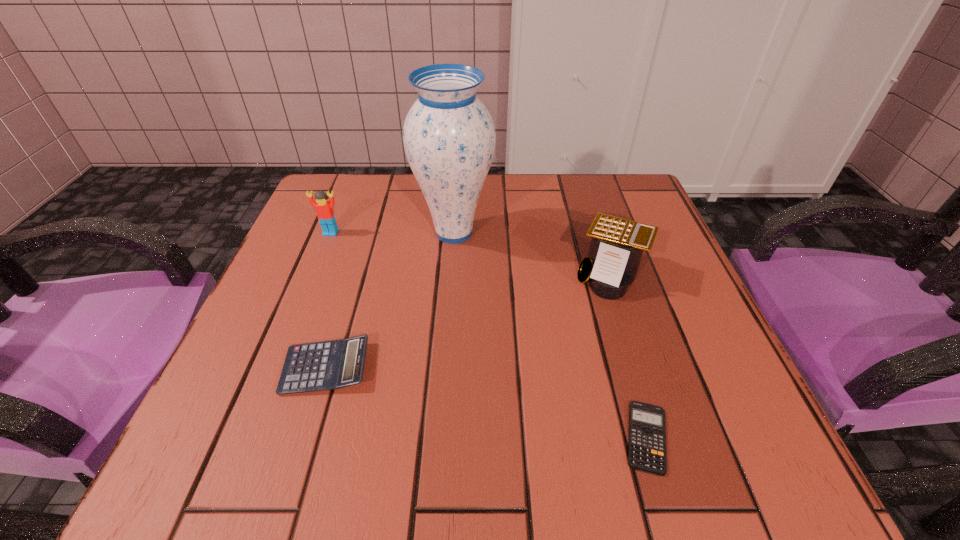
The height and width of the screenshot is (540, 960). What are the coordinates of `free point located on the face of the Lego` in the screenshot? It's located at (265, 395).

At what (x,y) coordinates should I click in order to perform the action: click on free space located 0.400m on the back of the fourth farthest object. Please return your answer as a coordinate pair (x, y). Looking at the image, I should click on (374, 210).

Image resolution: width=960 pixels, height=540 pixels. Find the location of `vacant space located 0.120m on the left of the nearest calculator`. vacant space located 0.120m on the left of the nearest calculator is located at coordinates (538, 437).

The width and height of the screenshot is (960, 540). Find the location of `vase positioned at the far edge`. vase positioned at the far edge is located at coordinates (449, 137).

Image resolution: width=960 pixels, height=540 pixels. I want to click on Lego that is at the far edge, so click(x=324, y=208).

Identify the location of object at the near edge. The width and height of the screenshot is (960, 540). (647, 440).

The image size is (960, 540). In order to click on Lego that is at the left edge in this screenshot , I will do `click(324, 208)`.

The width and height of the screenshot is (960, 540). Find the location of `calculator positioned at the left edge`. calculator positioned at the left edge is located at coordinates (328, 365).

Locate an element on the screen. object located at the far left corner is located at coordinates (324, 208).

This screenshot has height=540, width=960. What are the coordinates of `object that is at the near right corner` in the screenshot? It's located at (647, 440).